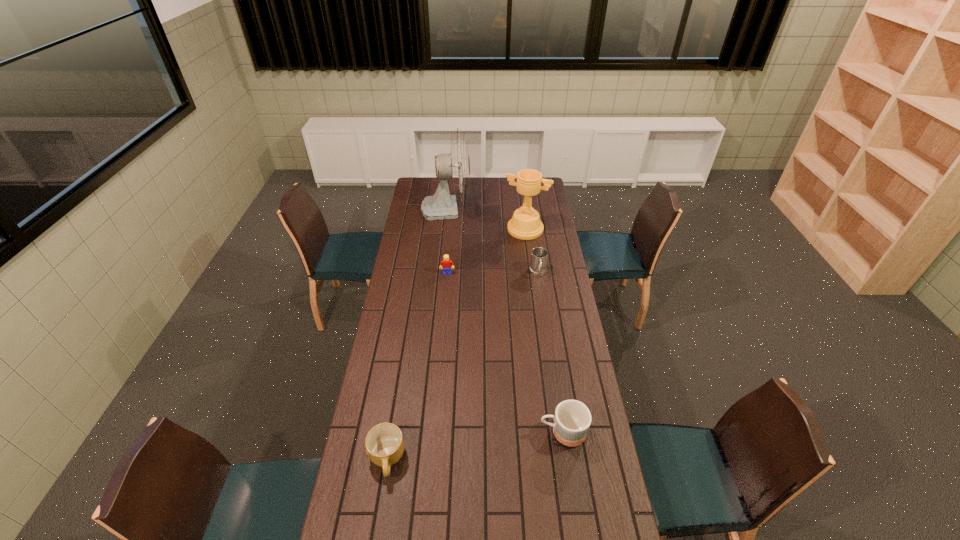
Locate which mug is the closest to the award. Please provide its 2D coordinates. Your answer should be formatted as a tuple, i.e. [(x, y)], where the tuple contains the x and y coordinates of a point satisfying the conditions above.

[(538, 262)]

Image resolution: width=960 pixels, height=540 pixels. Identify the location of vacant space that satisfies the following two spatial constraints: 1. in front of the award to blow air; 2. on the left side of the tallest object. (444, 229).